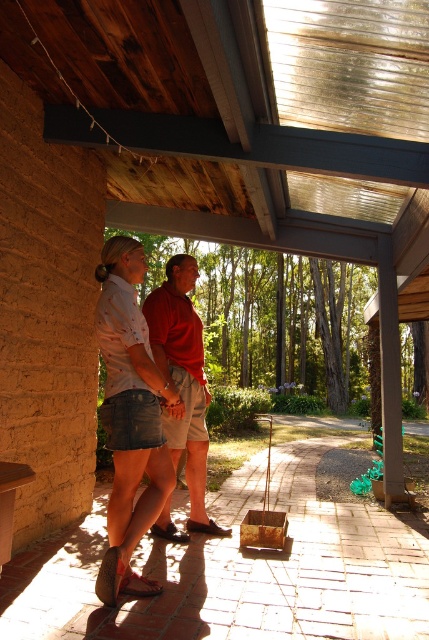
Does brown brick porch at lower center have a greater width compared to denim skirt at center?

Indeed, brown brick porch at lower center has a greater width compared to denim skirt at center.

Does point (221, 566) come in front of point (112, 502)?

No, (221, 566) is further to viewer.

Locate an element on the screen. brown brick porch at lower center is located at coordinates click(238, 570).

Is denim skirt at center wider than matte red shirt at center?

No.

Locate an element on the screen. denim skirt at center is located at coordinates (129, 417).

Is point (141, 452) positioned after point (205, 524)?

No, it is in front of (205, 524).

What are the coordinates of `denim skirt at center` in the screenshot? It's located at (129, 417).

Who is positioned more to the right, brown brick porch at lower center or matte red shirt at center?

From the viewer's perspective, brown brick porch at lower center appears more on the right side.

What are the coordinates of `brown brick porch at lower center` in the screenshot? It's located at (238, 570).

Which is behind, point (193, 609) or point (151, 305)?

The point (151, 305) is more distant.

At what (x,y) coordinates should I click in order to perform the action: click on brown brick porch at lower center. Please return your answer as a coordinate pair (x, y). The width and height of the screenshot is (429, 640). Looking at the image, I should click on (238, 570).